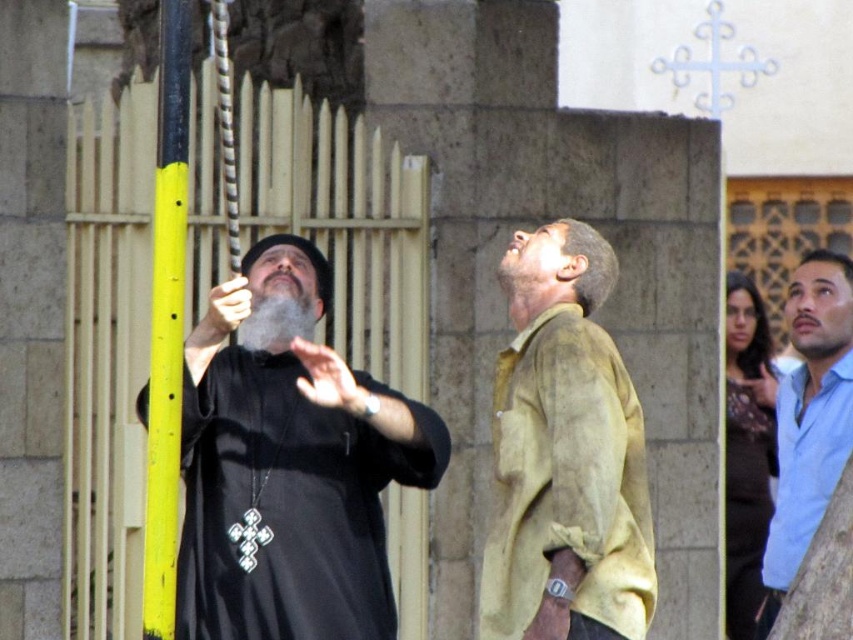
Does black matte robe at left come in front of light brown leather shirt at center?

Yes, it is in front of light brown leather shirt at center.

Locate an element on the screen. This screenshot has width=853, height=640. black matte robe at left is located at coordinates (288, 504).

You are a GUI agent. You are given a task and a screenshot of the screen. Output one action in this format:
    pyautogui.click(x=<x>, y=<y>)
    Task: Click on the black matte robe at left
    This screenshot has width=853, height=640.
    Given the screenshot: What is the action you would take?
    pyautogui.click(x=288, y=504)

Measure the distance between point (180, 84) and camera.

→ Point (180, 84) is 23.05 meters away from camera.

Does point (170, 84) come closer to viewer compared to point (746, 449)?

Yes.

This screenshot has height=640, width=853. I want to click on yellow painted metal pole at left, so click(x=166, y=320).

You are a GUI agent. You are given a task and a screenshot of the screen. Output one action in this format:
    pyautogui.click(x=<x>, y=<y>)
    Task: Click on the yellow painted metal pole at left
    The height and width of the screenshot is (640, 853).
    Given the screenshot: What is the action you would take?
    pyautogui.click(x=166, y=320)

Who is positioned more to the right, yellow painted metal pole at left or blue cotton shirt at right?

blue cotton shirt at right is more to the right.

The height and width of the screenshot is (640, 853). Find the location of `yellow painted metal pole at left`. yellow painted metal pole at left is located at coordinates (166, 320).